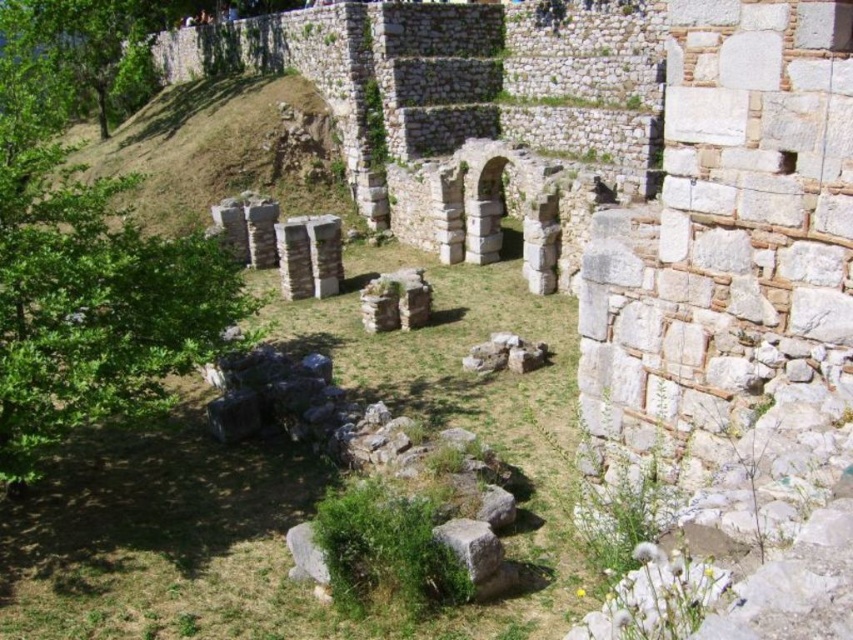
You are an archaeologist standing at the edge of the site. You need to place a marker at the exact center of the green grass at center. What are the coordinates where you should place the marker?

The coordinates for the green grass at center are at point (299, 483), so you should place the marker there.

You are an archaeologist standing at the base of the slope where the green leafy tree at left and the green mossy rock at center are visible. Which object would you encounter first as you walk towards the slope?

The green leafy tree at left is closer to you than the green mossy rock at center, so you would encounter the green leafy tree at left first.

You are an archaeologist examining the site. You notice the green grass at center and the green leafy tree at left. Which object is positioned lower in the image?

The green grass at center is positioned lower than the green leafy tree at left.